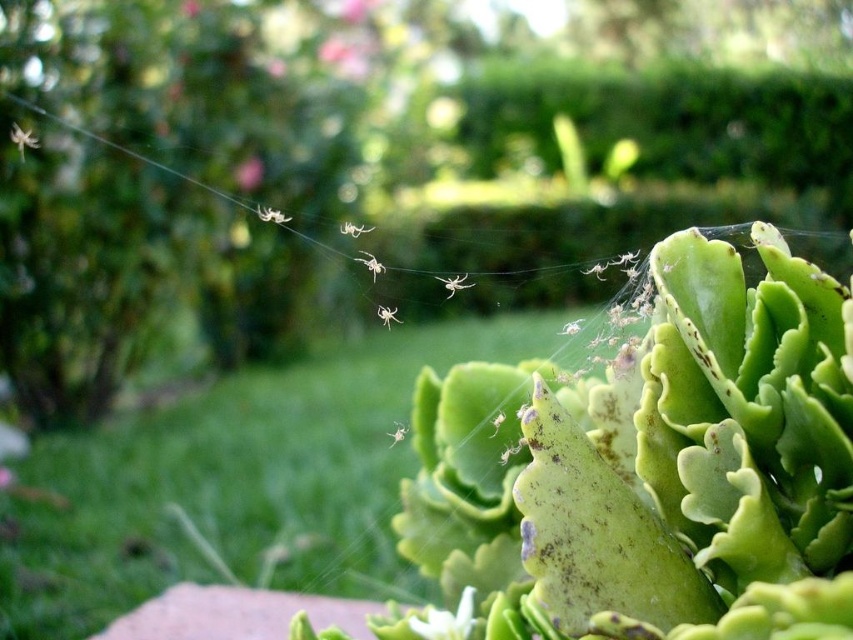
You are a gardener looking at the garden scene. You notice the green leafy plant at lower right and the white matte spider at upper center. Which object is taller?

The green leafy plant at lower right is taller than the white matte spider at upper center.

You are a gardener who wants to place a small decorative stone between the white matte spider at upper center and the green matte leaf at center. Based on their sizes, which object should the stone be placed closer to?

The white matte spider at upper center might be wider than the green matte leaf at center, so the stone should be placed closer to the green matte leaf at center to ensure proper spacing.

You are a photographer aiming to capture the white matte spider at upper center and the green matte leaf at center in a single shot. Given that your camera can only focus on objects within a height range of 1 meter, will both fit within this range?

The white matte spider at upper center is taller than the green matte leaf at center. Since the camera can focus on objects within 1 meter, both will fit as long as their combined height doesn